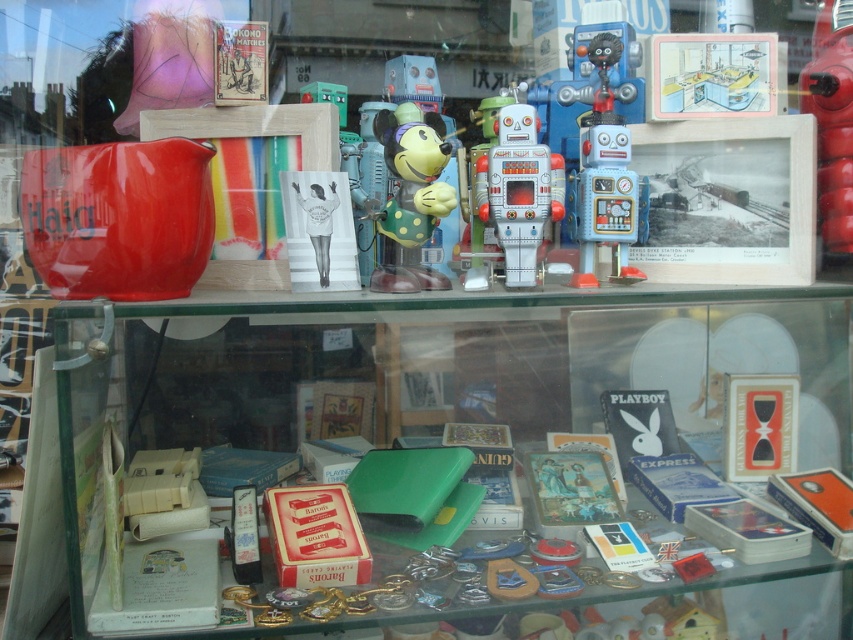
Which is in front, point (836, 38) or point (627, 147)?

Point (627, 147)

Between shiny red robot at upper right and metallic blue robot at center-right, which one is positioned higher?

shiny red robot at upper right is higher up.

Who is more distant from viewer, (839, 184) or (612, 172)?

The point (839, 184) is behind.

At what (x,y) coordinates should I click in order to perform the action: click on shiny red robot at upper right. Please return your answer as a coordinate pair (x, y). Looking at the image, I should click on (833, 120).

Is point (790, 428) positioned in front of point (474, 256)?

No, (790, 428) is further to viewer.

Measure the distance between green plastic box at lower center and camera.

green plastic box at lower center is 30.30 inches away from camera.

Find the location of a particular element. green plastic box at lower center is located at coordinates (465, 452).

Is metallic tin robot at center positioned behind metallic robot at center?

Yes.

Does metallic tin robot at center have a greater width compared to metallic robot at center?

Indeed, metallic tin robot at center has a greater width compared to metallic robot at center.

Locate an element on the screen. The width and height of the screenshot is (853, 640). metallic tin robot at center is located at coordinates (519, 189).

The height and width of the screenshot is (640, 853). Identify the location of metallic tin robot at center. (519, 189).